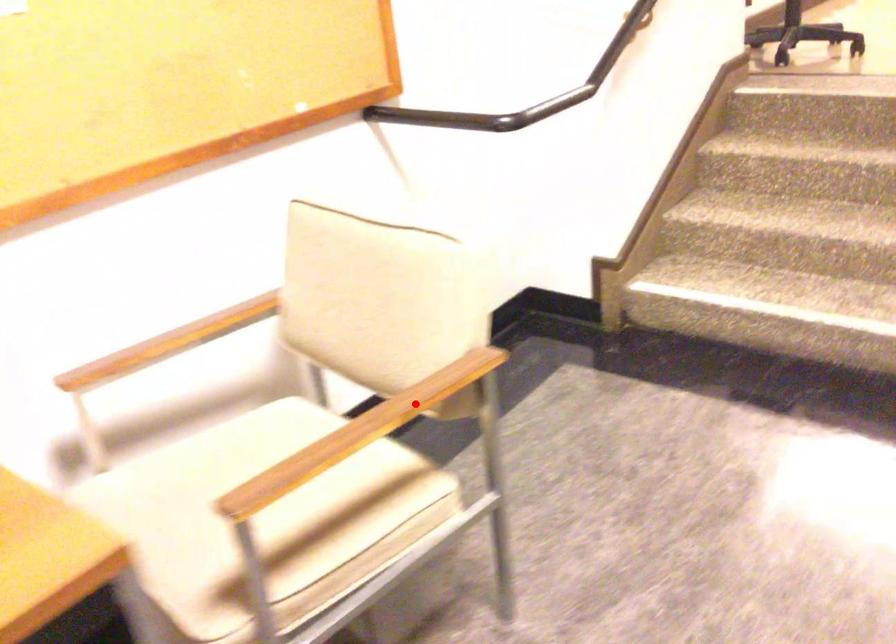
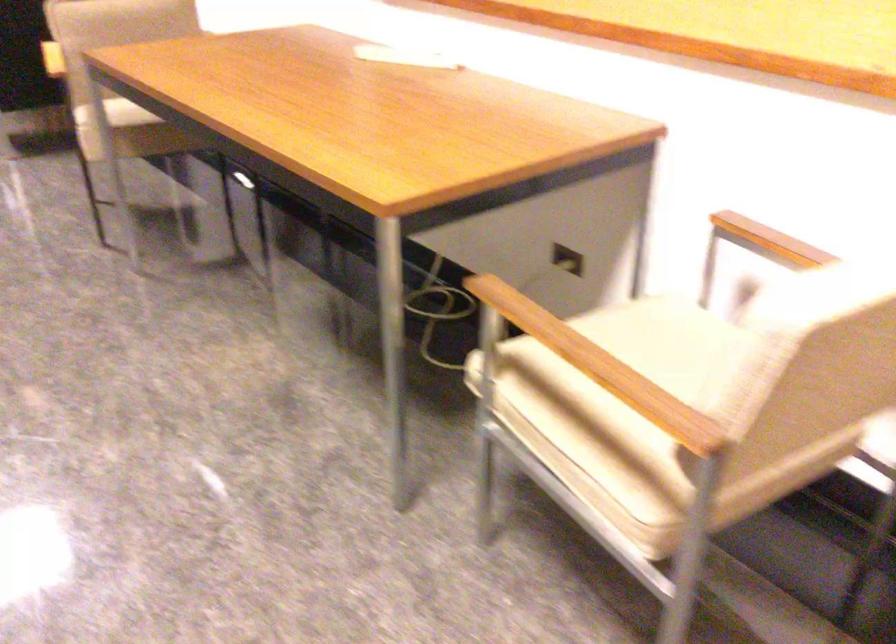
The point at the highlighted location is marked in the first image. Where is the corresponding point in the second image?

(599, 366)